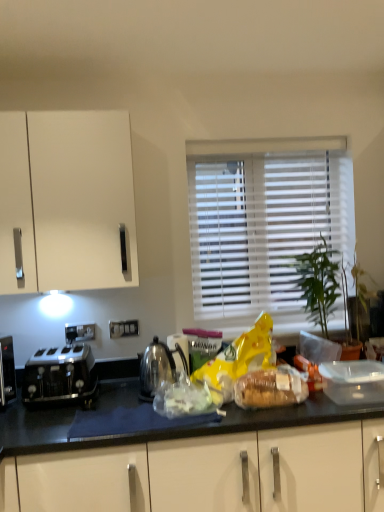
Question: Does translucent plastic bag at center, positioned as the first food in left-to-right order, have a larger size compared to translucent plastic bread at center, which appears as the 2th food when viewed from the left?

Choices:
 (A) no
 (B) yes

Answer: (A)

Question: From a real-world perspective, is translucent plastic bag at center, the 2th food from the right, on translucent plastic bread at center, which appears as the 2th food when viewed from the left?

Choices:
 (A) no
 (B) yes

Answer: (A)

Question: Is translucent plastic bag at center, positioned as the first food in left-to-right order, thinner than translucent plastic bread at center, which appears as the 2th food when viewed from the left?

Choices:
 (A) no
 (B) yes

Answer: (A)

Question: Is translucent plastic bag at center, positioned as the first food in left-to-right order, not inside translucent plastic bread at center, marked as the first food in a right-to-left arrangement?

Choices:
 (A) no
 (B) yes

Answer: (B)

Question: Can you confirm if translucent plastic bag at center, positioned as the first food in left-to-right order, is taller than translucent plastic bread at center, marked as the first food in a right-to-left arrangement?

Choices:
 (A) yes
 (B) no

Answer: (B)

Question: Is white blinds at center spatially inside translucent plastic bag at center, the 2th food from the right, or outside of it?

Choices:
 (A) outside
 (B) inside

Answer: (A)

Question: Relative to translucent plastic bag at center, the 2th food from the right, is white blinds at center in front or behind?

Choices:
 (A) behind
 (B) front

Answer: (A)

Question: Is point (266, 218) closer or farther from the camera than point (167, 393)?

Choices:
 (A) farther
 (B) closer

Answer: (A)

Question: In terms of width, does white blinds at center look wider or thinner when compared to translucent plastic bag at center, positioned as the first food in left-to-right order?

Choices:
 (A) thin
 (B) wide

Answer: (A)

Question: From a real-world perspective, is translucent plastic bag at center, positioned as the first food in left-to-right order, physically located above or below translucent plastic bread at center, which appears as the 2th food when viewed from the left?

Choices:
 (A) above
 (B) below

Answer: (B)

Question: From the image's perspective, relative to translucent plastic bread at center, marked as the first food in a right-to-left arrangement, is translucent plastic bag at center, the 2th food from the right, above or below?

Choices:
 (A) above
 (B) below

Answer: (B)

Question: Would you say translucent plastic bag at center, positioned as the first food in left-to-right order, is to the left or to the right of translucent plastic bread at center, marked as the first food in a right-to-left arrangement, in the picture?

Choices:
 (A) right
 (B) left

Answer: (B)

Question: Is point (155, 401) closer or farther from the camera than point (235, 400)?

Choices:
 (A) farther
 (B) closer

Answer: (B)

Question: Would you say translucent plastic bread at center, which appears as the 2th food when viewed from the left, is to the left or to the right of white blinds at center in the picture?

Choices:
 (A) left
 (B) right

Answer: (A)

Question: Considering the positions of translucent plastic bread at center, marked as the first food in a right-to-left arrangement, and white blinds at center in the image, is translucent plastic bread at center, marked as the first food in a right-to-left arrangement, bigger or smaller than white blinds at center?

Choices:
 (A) small
 (B) big

Answer: (A)